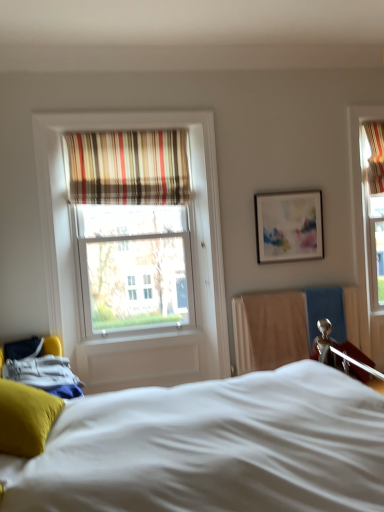
Question: Is striped fabric curtain at upper center smaller than white soft bed at center?

Choices:
 (A) no
 (B) yes

Answer: (B)

Question: Is there a large distance between striped fabric curtain at upper center and white soft bed at center?

Choices:
 (A) yes
 (B) no

Answer: (A)

Question: Considering the relative sizes of striped fabric curtain at upper center and white soft bed at center in the image provided, is striped fabric curtain at upper center thinner than white soft bed at center?

Choices:
 (A) no
 (B) yes

Answer: (B)

Question: Considering the relative positions of striped fabric curtain at upper center and white soft bed at center in the image provided, is striped fabric curtain at upper center in front of white soft bed at center?

Choices:
 (A) yes
 (B) no

Answer: (B)

Question: Could you tell me if striped fabric curtain at upper center is facing white soft bed at center?

Choices:
 (A) yes
 (B) no

Answer: (B)

Question: Considering the relative sizes of striped fabric curtain at upper center and white soft bed at center in the image provided, is striped fabric curtain at upper center wider than white soft bed at center?

Choices:
 (A) no
 (B) yes

Answer: (A)

Question: Is soft yellow pillow at lower left positioned with its back to matte white picture frame at upper right?

Choices:
 (A) yes
 (B) no

Answer: (B)

Question: Is soft yellow pillow at lower left thinner than matte white picture frame at upper right?

Choices:
 (A) no
 (B) yes

Answer: (A)

Question: Is soft yellow pillow at lower left next to matte white picture frame at upper right and touching it?

Choices:
 (A) no
 (B) yes

Answer: (A)

Question: Is soft yellow pillow at lower left outside matte white picture frame at upper right?

Choices:
 (A) yes
 (B) no

Answer: (A)

Question: From a real-world perspective, does soft yellow pillow at lower left stand above matte white picture frame at upper right?

Choices:
 (A) yes
 (B) no

Answer: (B)

Question: Is matte white picture frame at upper right a part of soft yellow pillow at lower left?

Choices:
 (A) no
 (B) yes

Answer: (A)

Question: Is white soft bed at center positioned in front of matte white picture frame at upper right?

Choices:
 (A) yes
 (B) no

Answer: (A)